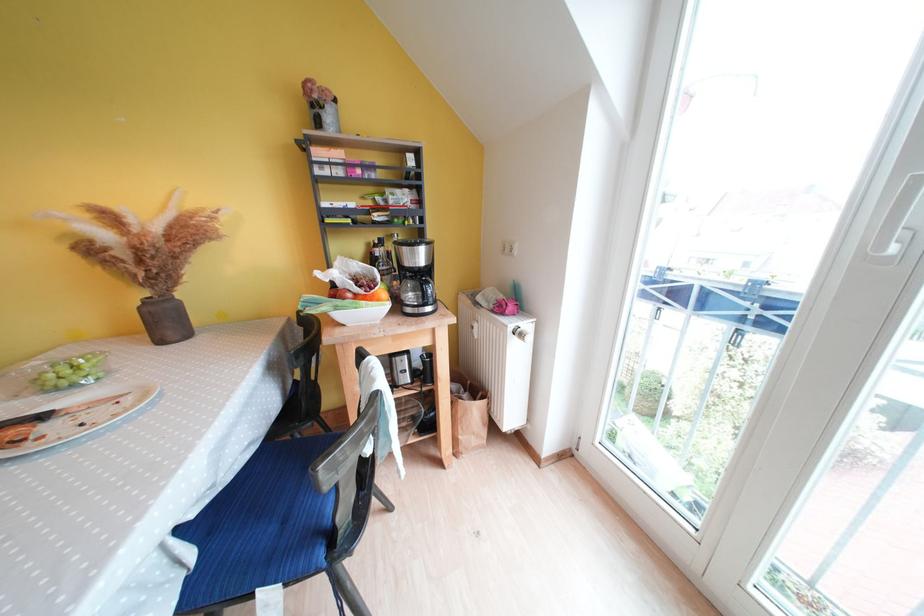
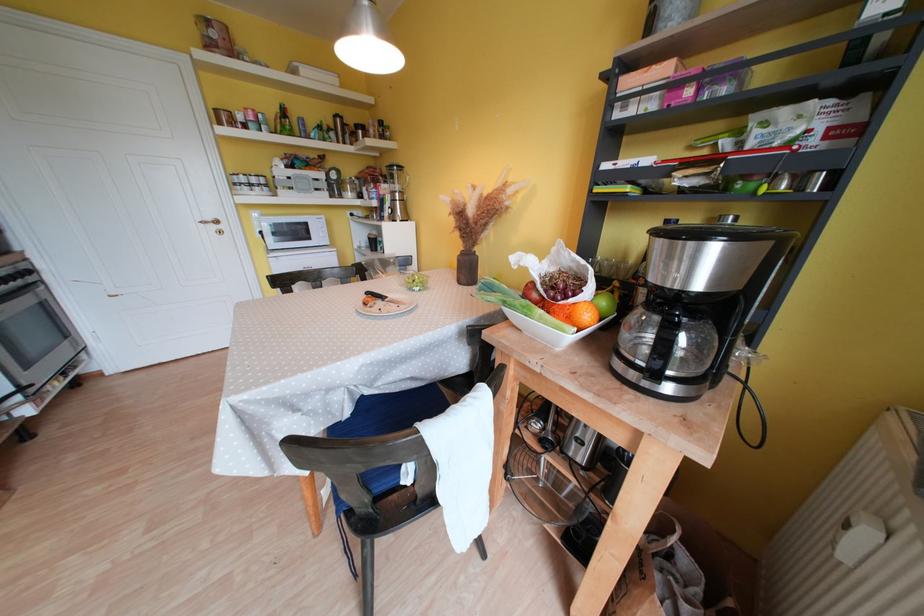
Find the pixel in the second image that matches point (49, 419) in the first image.

(390, 301)